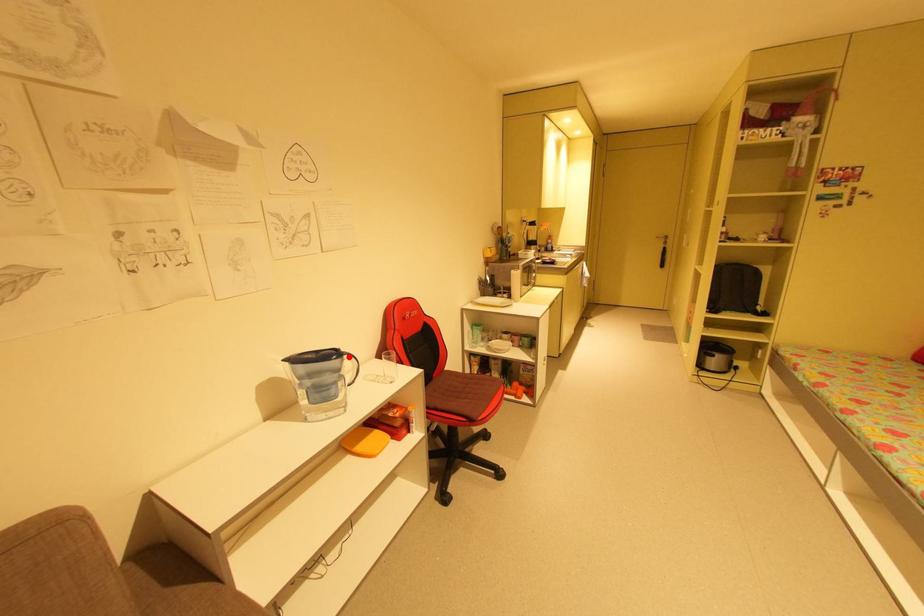
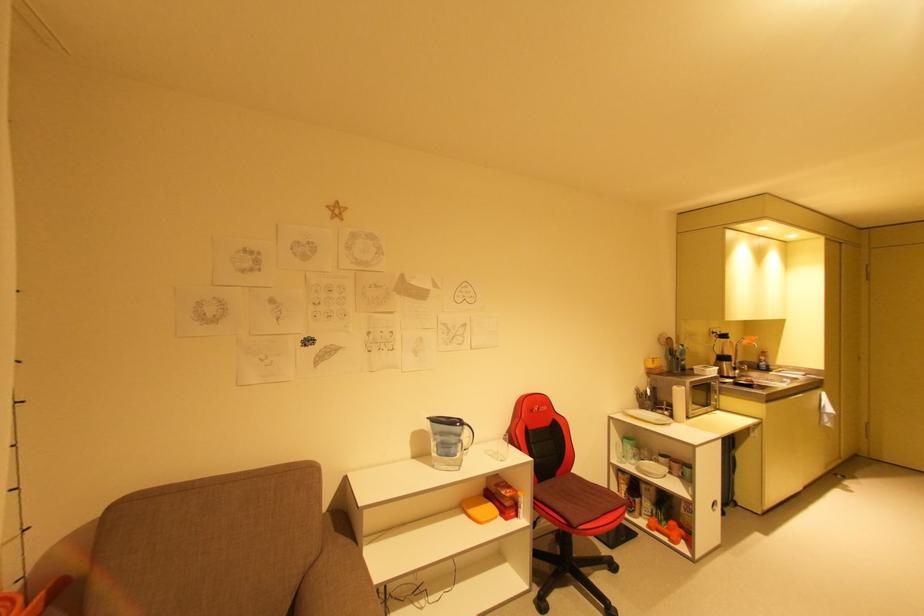
Question: A red point is marked in image1. In image2, is the corresponding 3D point closer to the camera or farther? Reply with the corresponding letter.

Choices:
 (A) The corresponding 3D point is closer.
 (B) The corresponding 3D point is farther.

Answer: (B)